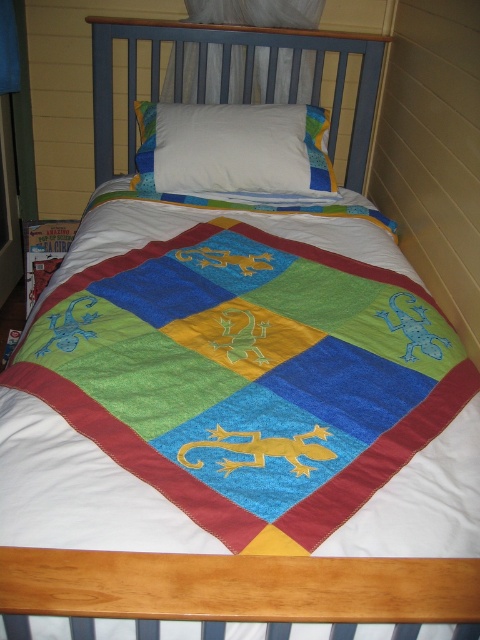
Question: Is the position of blue painted wood headboard at upper center less distant than that of white soft pillow at center?

Choices:
 (A) no
 (B) yes

Answer: (A)

Question: Does blue painted wood headboard at upper center appear under white soft pillow at center?

Choices:
 (A) yes
 (B) no

Answer: (B)

Question: Which point is closer to the camera?

Choices:
 (A) white soft pillow at center
 (B) blue painted wood headboard at upper center

Answer: (A)

Question: Is blue painted wood headboard at upper center to the right of white soft pillow at center from the viewer's perspective?

Choices:
 (A) no
 (B) yes

Answer: (A)